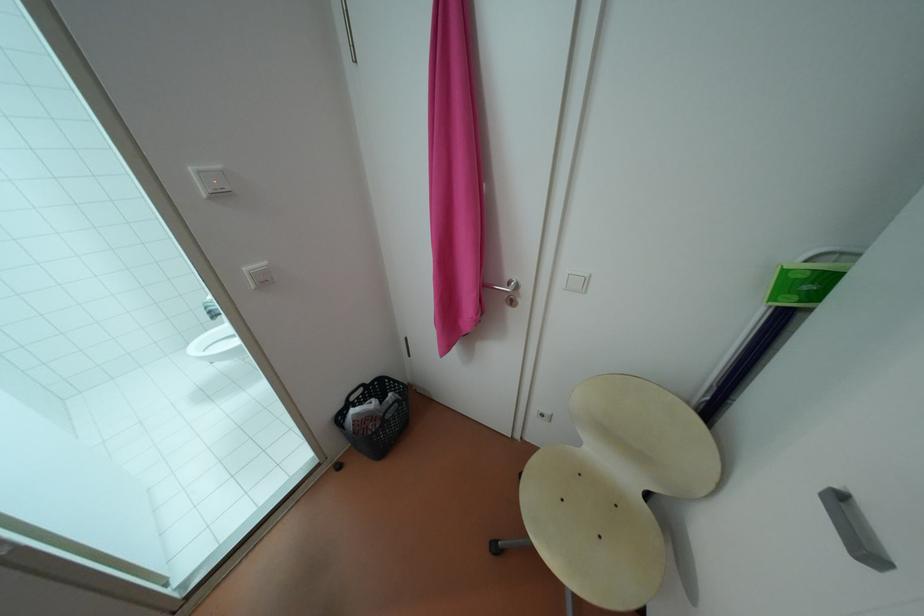
Where is `black basket handle`? Image resolution: width=924 pixels, height=616 pixels. black basket handle is located at coordinates (367, 395).